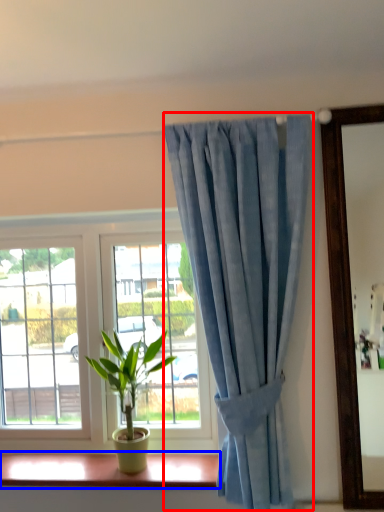
Question: Which object appears farthest to the camera in this image, curtain (highlighted by a red box) or window sill (highlighted by a blue box)?

Choices:
 (A) curtain
 (B) window sill

Answer: (B)